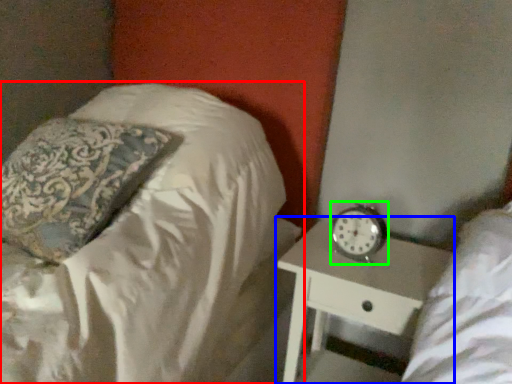
Question: Based on their relative distances, which object is nearer to bed (highlighted by a red box)? Choose from nightstand (highlighted by a blue box) and clock (highlighted by a green box).

Choices:
 (A) nightstand
 (B) clock

Answer: (A)